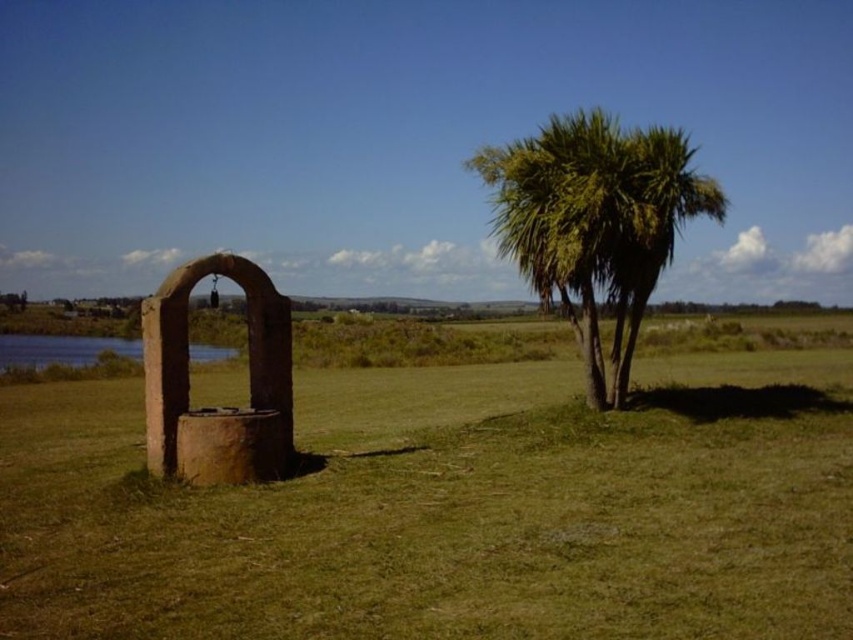
You are standing at the center of the image and want to walk towards the green grass at lower left. What direction should you face to walk directly towards it?

Since the green grass at lower left is located at point (x=450, y=509), you should face towards the lower left direction to walk directly towards it.

You are standing at the center of the scene looking towards the well. Which object is closer to your feet, the green grass at lower left or the green leafy palm at right?

The green grass at lower left is closer to your feet because it is located below the green leafy palm at right, meaning it is positioned lower in the scene.